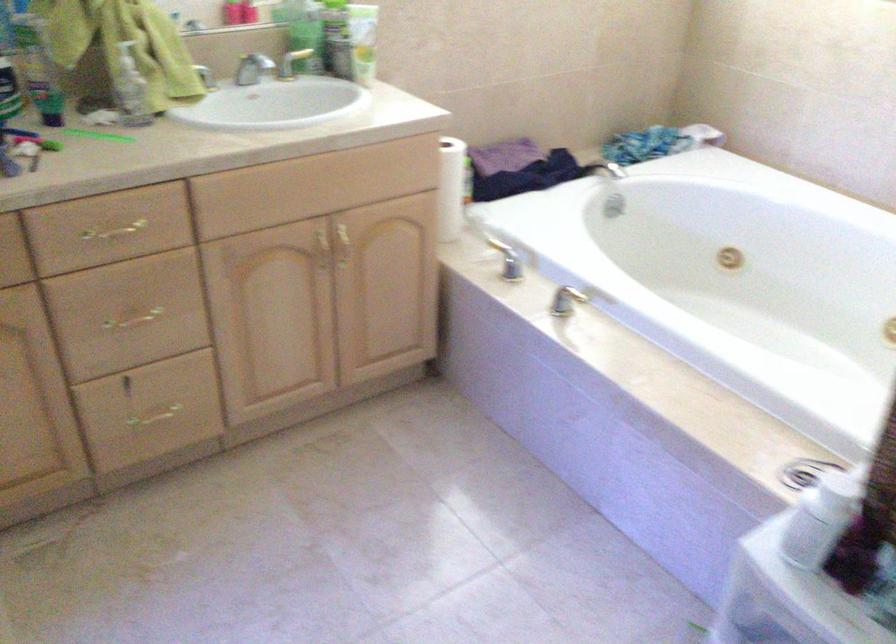
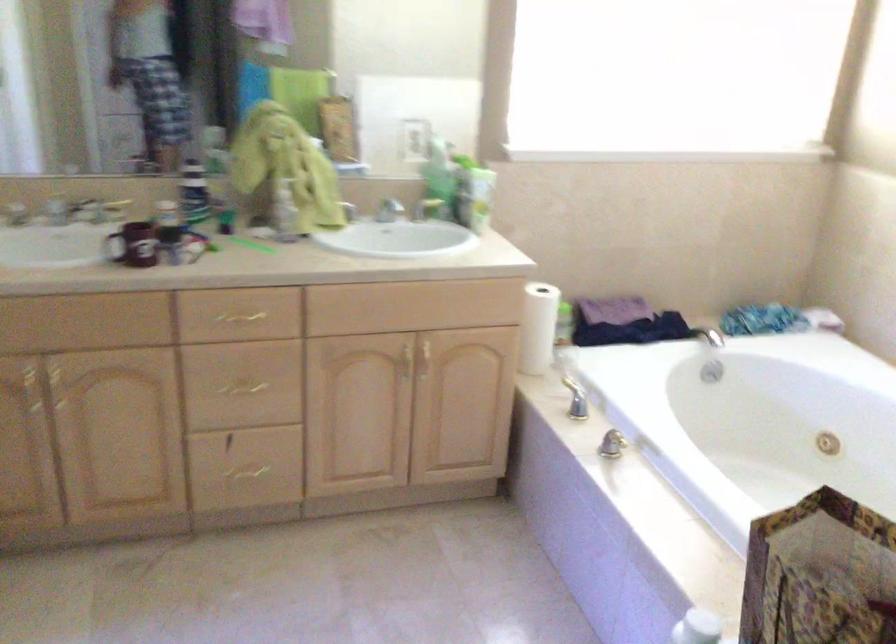
In the second image, find the point that corresponds to (x=320, y=254) in the first image.

(406, 363)